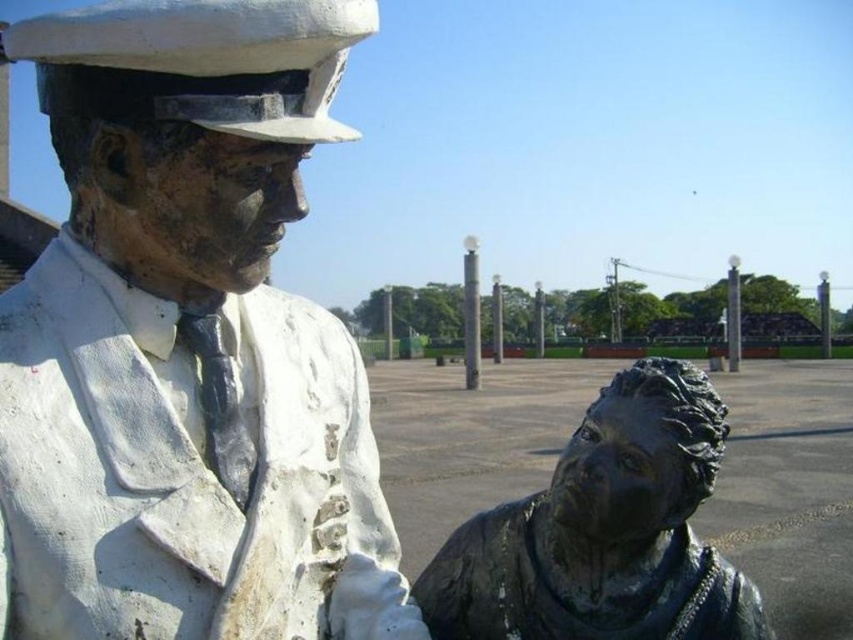
Between bronze statue at left and bronze statue at lower right, which one is positioned higher?

Positioned higher is bronze statue at left.

Can you confirm if bronze statue at left is wider than bronze statue at lower right?

Yes, bronze statue at left is wider than bronze statue at lower right.

At what (x,y) coordinates should I click in order to perform the action: click on bronze statue at left. Please return your answer as a coordinate pair (x, y). This screenshot has height=640, width=853. Looking at the image, I should click on (187, 342).